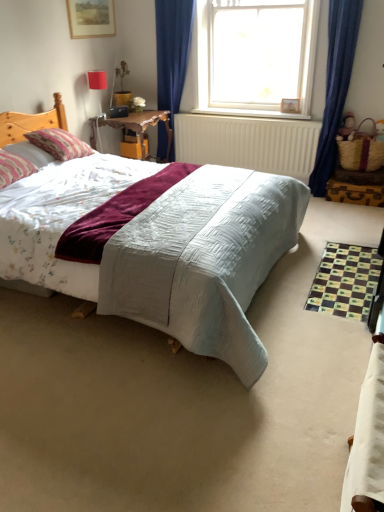
Locate an element on the screen. vacant region under matte red lampshade at upper left (from a real-world perspective) is located at coordinates (100, 118).